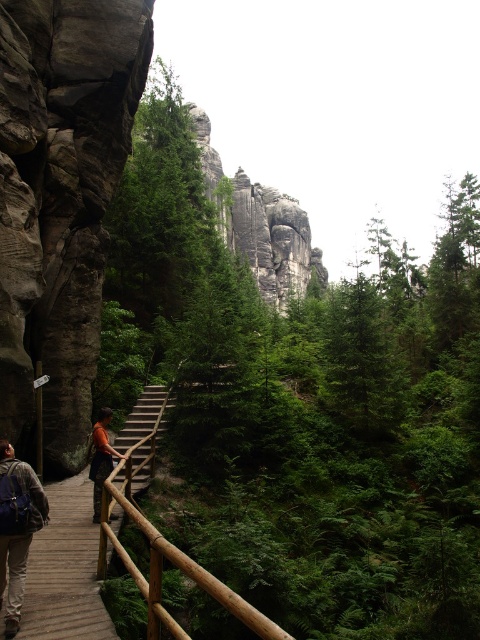
You are planning to hike along the wooden boardwalk and need to determine if your backpack will fit through the space between the wooden stairs at center and the orange fabric shirt at center. The backpack measures 30 cm in width. Can you confirm if there is enough space?

The wooden stairs at center is larger in size than the orange fabric shirt at center, but without specific measurements of the space between them, it is impossible to determine if the backpack will fit. Please check the actual distance on site.

You are standing at the starting point of the boardwalk and want to reach the dramatic rock formation in the distance. There are two markers along the path labeled as point 1 at coordinates point (82, 483) and point 2 at coordinates point (147, 417). Which point should you reach first while moving towards the rock formation?

Point 1 at coordinates point (82, 483) should be reached first because it is in front of point 2 at coordinates point (147, 417) along the path towards the rock formation.